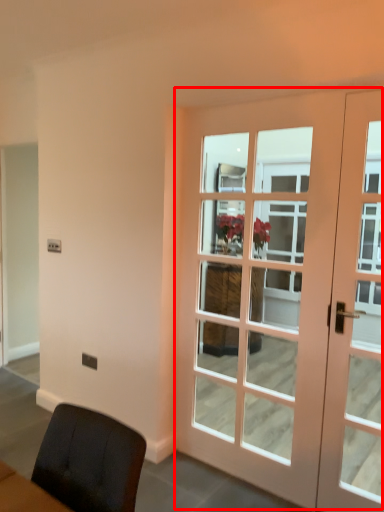
Question: From the image's perspective, where is door (annotated by the red box) located in relation to door in the image?

Choices:
 (A) above
 (B) below

Answer: (A)